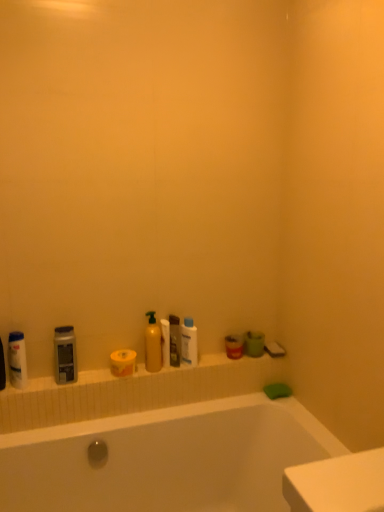
Question: Should I look upward or downward to see white glossy bottle at center?

Choices:
 (A) down
 (B) up

Answer: (A)

Question: Considering the relative positions of white glossy bottle at center and matte plastic mouthwash at center, which is the 2th mouthwash from front to back, in the image provided, is white glossy bottle at center to the right of matte plastic mouthwash at center, which is the 2th mouthwash from front to back, from the viewer's perspective?

Choices:
 (A) yes
 (B) no

Answer: (B)

Question: Is the depth of white glossy bottle at center less than that of matte plastic mouthwash at center, which is the 2th mouthwash from front to back?

Choices:
 (A) yes
 (B) no

Answer: (A)

Question: Is white glossy bottle at center oriented towards matte plastic mouthwash at center, the 2th mouthwash when ordered from left to right?

Choices:
 (A) no
 (B) yes

Answer: (A)

Question: Is white glossy bottle at center not close to matte plastic mouthwash at center, the 1th mouthwash viewed from the back?

Choices:
 (A) yes
 (B) no

Answer: (B)

Question: Could matte plastic mouthwash at center, the first mouthwash in the right-to-left sequence, be considered to be inside white glossy bottle at center?

Choices:
 (A) yes
 (B) no

Answer: (B)

Question: From the image's perspective, is white glossy bottle at center below matte plastic mouthwash at center, the first mouthwash in the right-to-left sequence?

Choices:
 (A) yes
 (B) no

Answer: (B)

Question: Considering the relative sizes of matte plastic mouthwash at center, which is the 2th mouthwash from front to back, and yellow matte toilet paper at center, acting as the 1th toilet paper starting from the left, in the image provided, is matte plastic mouthwash at center, which is the 2th mouthwash from front to back, thinner than yellow matte toilet paper at center, acting as the 1th toilet paper starting from the left,?

Choices:
 (A) no
 (B) yes

Answer: (B)

Question: Is matte plastic mouthwash at center, the first mouthwash in the right-to-left sequence, beside yellow matte toilet paper at center, acting as the 1th toilet paper starting from the left?

Choices:
 (A) no
 (B) yes

Answer: (A)

Question: Can you confirm if matte plastic mouthwash at center, the first mouthwash in the right-to-left sequence, is smaller than yellow matte toilet paper at center, marked as the second toilet paper in a right-to-left arrangement?

Choices:
 (A) no
 (B) yes

Answer: (B)

Question: Can you confirm if matte plastic mouthwash at center, the 1th mouthwash viewed from the back, is taller than yellow matte toilet paper at center, marked as the second toilet paper in a right-to-left arrangement?

Choices:
 (A) no
 (B) yes

Answer: (B)

Question: From the image's perspective, is matte plastic mouthwash at center, the 2th mouthwash when ordered from left to right, beneath yellow matte toilet paper at center, marked as the second toilet paper in a right-to-left arrangement?

Choices:
 (A) no
 (B) yes

Answer: (A)

Question: Is matte plastic mouthwash at center, the 2th mouthwash when ordered from left to right, to the left of yellow matte toilet paper at center, marked as the second toilet paper in a right-to-left arrangement, from the viewer's perspective?

Choices:
 (A) no
 (B) yes

Answer: (A)

Question: Is matte gray bottle at left, which ranks as the third cleaning product in right-to-left order, far away from white matte toilet paper at center, the 2th toilet paper when ordered from left to right?

Choices:
 (A) no
 (B) yes

Answer: (A)